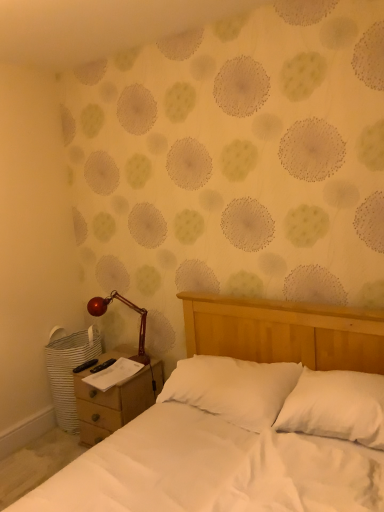
This screenshot has width=384, height=512. Find the location of `white soft pillow at center, the first pillow from the right`. white soft pillow at center, the first pillow from the right is located at coordinates (336, 406).

You are a GUI agent. You are given a task and a screenshot of the screen. Output one action in this format:
    pyautogui.click(x=<x>, y=<y>)
    Task: Click on the white soft pillow at center, placed as the 1th pillow when sorted from left to right
    The image size is (384, 512).
    Given the screenshot: What is the action you would take?
    [x=233, y=388]

Image resolution: width=384 pixels, height=512 pixels. What do you see at coordinates (115, 402) in the screenshot?
I see `wooden nightstand at lower left` at bounding box center [115, 402].

Describe the element at coordinates (130, 308) in the screenshot. I see `shiny red metal lamp at left` at that location.

You are a GUI agent. You are given a task and a screenshot of the screen. Output one action in this format:
    pyautogui.click(x=<x>, y=<y>)
    Task: Click on the white soft pillow at center, the first pillow from the right
    Image resolution: width=384 pixels, height=512 pixels.
    Given the screenshot: What is the action you would take?
    pyautogui.click(x=336, y=406)

Would you say wooden nightstand at lower left is a long distance from white soft pillow at center, the first pillow from the right?

Yes.

From the image's perspective, which object appears higher, wooden nightstand at lower left or white soft pillow at center, the first pillow from the right?

white soft pillow at center, the first pillow from the right, appears higher in the image.

Choose the correct answer: Is wooden nightstand at lower left inside white soft pillow at center, the first pillow from the right, or outside it?

wooden nightstand at lower left is not enclosed by white soft pillow at center, the first pillow from the right.

Relative to wooden nightstand at lower left, is shiny red metal lamp at left in front or behind?

shiny red metal lamp at left is positioned farther from the viewer than wooden nightstand at lower left.

The width and height of the screenshot is (384, 512). Find the location of `lamp behind the wooden nightstand at lower left`. lamp behind the wooden nightstand at lower left is located at coordinates (130, 308).

Would you say shiny red metal lamp at left is inside or outside wooden nightstand at lower left?

shiny red metal lamp at left cannot be found inside wooden nightstand at lower left.

What's the angular difference between shiny red metal lamp at left and wooden nightstand at lower left's facing directions?

They differ by 12.9 degrees in their facing directions.

From a real-world perspective, is white soft pillow at center, the first pillow from the right, physically located above or below shiny red metal lamp at left?

From a real-world perspective, white soft pillow at center, the first pillow from the right, is physically below shiny red metal lamp at left.

Is white soft pillow at center, the first pillow from the right, next to shiny red metal lamp at left?

They are not placed beside each other.

From the image's perspective, is white soft pillow at center, the first pillow from the right, positioned above or below shiny red metal lamp at left?

From the image's perspective, white soft pillow at center, the first pillow from the right, appears below shiny red metal lamp at left.

How far apart are white soft pillow at center, placed as the 1th pillow when sorted from left to right, and white soft pillow at center, which appears as the 2th pillow when viewed from the left?

They are 10.50 inches apart.

Which object is further away from the camera, white soft pillow at center, placed as the 1th pillow when sorted from left to right, or white soft pillow at center, which appears as the 2th pillow when viewed from the left?

white soft pillow at center, placed as the 1th pillow when sorted from left to right, is further from the camera.

From the image's perspective, is white soft pillow at center, placed as the 1th pillow when sorted from left to right, above or below white soft pillow at center, which appears as the 2th pillow when viewed from the left?

Clearly, from the image's perspective, white soft pillow at center, placed as the 1th pillow when sorted from left to right, is below white soft pillow at center, which appears as the 2th pillow when viewed from the left.

Considering the relative sizes of white soft pillow at center, placed as the 1th pillow when sorted from left to right, and white soft pillow at center, the first pillow from the right, in the image provided, is white soft pillow at center, placed as the 1th pillow when sorted from left to right, wider than white soft pillow at center, the first pillow from the right,?

Yes, white soft pillow at center, placed as the 1th pillow when sorted from left to right, is wider than white soft pillow at center, the first pillow from the right.

In the image, there is a white soft pillow at center, placed as the 1th pillow when sorted from left to right. Where is `pillow above it (from the image's perspective)`? pillow above it (from the image's perspective) is located at coordinates (336, 406).

In the image, is white soft pillow at center, which appears as the 2th pillow when viewed from the left, on the left side or the right side of white soft pillow at center, placed as the 1th pillow when sorted from left to right?

white soft pillow at center, which appears as the 2th pillow when viewed from the left, is positioned on white soft pillow at center, placed as the 1th pillow when sorted from left to right,'s right side.

Could you tell me if white soft pillow at center, the first pillow from the right, is turned towards white soft pillow at center, the second pillow when ordered from right to left?

No, white soft pillow at center, the first pillow from the right, is not oriented towards white soft pillow at center, the second pillow when ordered from right to left.

Between white soft pillow at center, which appears as the 2th pillow when viewed from the left, and white soft pillow at center, placed as the 1th pillow when sorted from left to right, which one is positioned behind?

white soft pillow at center, placed as the 1th pillow when sorted from left to right, is more distant.

Which of these two, wooden nightstand at lower left or white soft pillow at center, the second pillow when ordered from right to left, is smaller?

Smaller between the two is white soft pillow at center, the second pillow when ordered from right to left.

You are a GUI agent. You are given a task and a screenshot of the screen. Output one action in this format:
    pyautogui.click(x=<x>, y=<y>)
    Task: Click on the nightstand that appears on the left of white soft pillow at center, placed as the 1th pillow when sorted from left to right
    The height and width of the screenshot is (512, 384).
    Given the screenshot: What is the action you would take?
    pyautogui.click(x=115, y=402)

Is wooden nightstand at lower left positioned with its back to white soft pillow at center, placed as the 1th pillow when sorted from left to right?

wooden nightstand at lower left is not turned away from white soft pillow at center, placed as the 1th pillow when sorted from left to right.

From the image's perspective, is wooden nightstand at lower left above white soft pillow at center, the second pillow when ordered from right to left?

No, from the image's perspective, wooden nightstand at lower left is not on top of white soft pillow at center, the second pillow when ordered from right to left.

Between shiny red metal lamp at left and white soft pillow at center, the second pillow when ordered from right to left, which one has larger width?

With larger width is white soft pillow at center, the second pillow when ordered from right to left.

Does shiny red metal lamp at left have a lesser height compared to white soft pillow at center, the second pillow when ordered from right to left?

No.

From a real-world perspective, is shiny red metal lamp at left beneath white soft pillow at center, placed as the 1th pillow when sorted from left to right?

No, from a real-world perspective, shiny red metal lamp at left is not under white soft pillow at center, placed as the 1th pillow when sorted from left to right.

In the scene shown: From the image's perspective, which one is positioned lower, shiny red metal lamp at left or white soft pillow at center, placed as the 1th pillow when sorted from left to right?

white soft pillow at center, placed as the 1th pillow when sorted from left to right, from the image's perspective.

From the image's perspective, count 2nd pillows upward from the wooden nightstand at lower left and point to it. Please provide its 2D coordinates.

[(336, 406)]

Where is `nightstand on the left side of shiny red metal lamp at left`? nightstand on the left side of shiny red metal lamp at left is located at coordinates (115, 402).

From the image, which object appears to be farther from wooden nightstand at lower left, shiny red metal lamp at left or white soft pillow at center, the first pillow from the right?

The object further to wooden nightstand at lower left is white soft pillow at center, the first pillow from the right.

Looking at the image, which one is located further to wooden nightstand at lower left, shiny red metal lamp at left or white soft pillow at center, the second pillow when ordered from right to left?

Based on the image, white soft pillow at center, the second pillow when ordered from right to left, appears to be further to wooden nightstand at lower left.

Based on their spatial positions, is wooden nightstand at lower left or white soft pillow at center, the second pillow when ordered from right to left, closer to shiny red metal lamp at left?

wooden nightstand at lower left is closer to shiny red metal lamp at left.

Estimate the real-world distances between objects in this image. Which object is further from white soft pillow at center, the second pillow when ordered from right to left, shiny red metal lamp at left or white soft pillow at center, the first pillow from the right?

shiny red metal lamp at left is positioned further to the anchor white soft pillow at center, the second pillow when ordered from right to left.

Looking at the image, which one is located closer to white soft pillow at center, which appears as the 2th pillow when viewed from the left, white soft pillow at center, the second pillow when ordered from right to left, or shiny red metal lamp at left?

white soft pillow at center, the second pillow when ordered from right to left.

From the image, which object appears to be farther from wooden nightstand at lower left, white soft pillow at center, the second pillow when ordered from right to left, or white soft pillow at center, which appears as the 2th pillow when viewed from the left?

white soft pillow at center, which appears as the 2th pillow when viewed from the left.

When comparing their distances from wooden nightstand at lower left, does white soft pillow at center, which appears as the 2th pillow when viewed from the left, or white soft pillow at center, the second pillow when ordered from right to left, seem closer?

The object closer to wooden nightstand at lower left is white soft pillow at center, the second pillow when ordered from right to left.

When comparing their distances from shiny red metal lamp at left, does white soft pillow at center, which appears as the 2th pillow when viewed from the left, or white soft pillow at center, the second pillow when ordered from right to left, seem closer?

white soft pillow at center, the second pillow when ordered from right to left, is closer to shiny red metal lamp at left.

Where is `lamp between wooden nightstand at lower left and white soft pillow at center, the first pillow from the right`? This screenshot has width=384, height=512. lamp between wooden nightstand at lower left and white soft pillow at center, the first pillow from the right is located at coordinates (130, 308).

The image size is (384, 512). Identify the location of pillow between wooden nightstand at lower left and white soft pillow at center, which appears as the 2th pillow when viewed from the left. (233, 388).

The image size is (384, 512). Find the location of `nightstand between white soft pillow at center, placed as the 1th pillow when sorted from left to right, and shiny red metal lamp at left, along the z-axis`. nightstand between white soft pillow at center, placed as the 1th pillow when sorted from left to right, and shiny red metal lamp at left, along the z-axis is located at coordinates (115, 402).

You are a GUI agent. You are given a task and a screenshot of the screen. Output one action in this format:
    pyautogui.click(x=<x>, y=<y>)
    Task: Click on the pillow situated between shiny red metal lamp at left and white soft pillow at center, which appears as the 2th pillow when viewed from the left, from left to right
    Image resolution: width=384 pixels, height=512 pixels.
    Given the screenshot: What is the action you would take?
    233,388